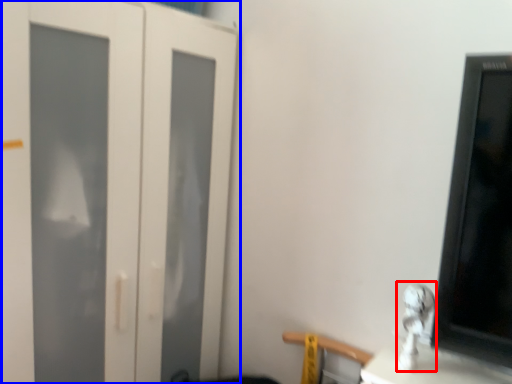
Question: Among these objects, which one is farthest to the camera, silver (highlighted by a red box) or door (highlighted by a blue box)?

Choices:
 (A) silver
 (B) door

Answer: (B)